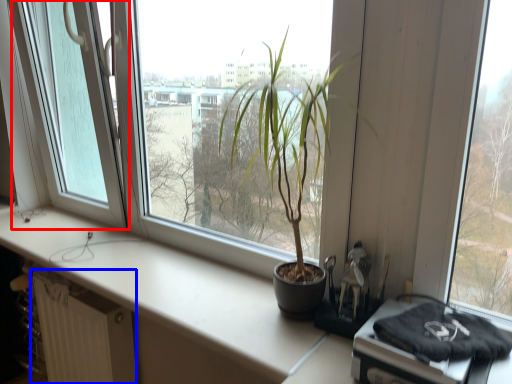
Question: Which of the following is the farthest to the observer, glass door (highlighted by a red box) or radiator (highlighted by a blue box)?

Choices:
 (A) glass door
 (B) radiator

Answer: (B)